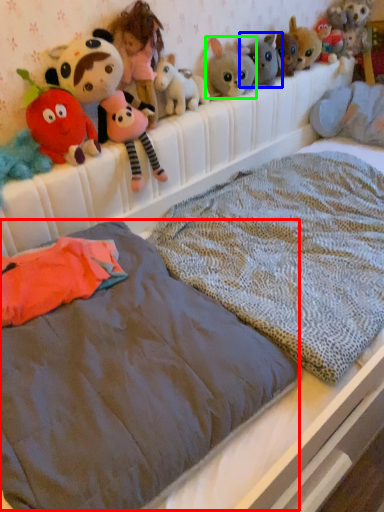
Question: Estimate the real-world distances between objects in this image. Which object is closer to mattress (highlighted by a red box), toy (highlighted by a blue box) or toy (highlighted by a green box)?

Choices:
 (A) toy
 (B) toy

Answer: (B)